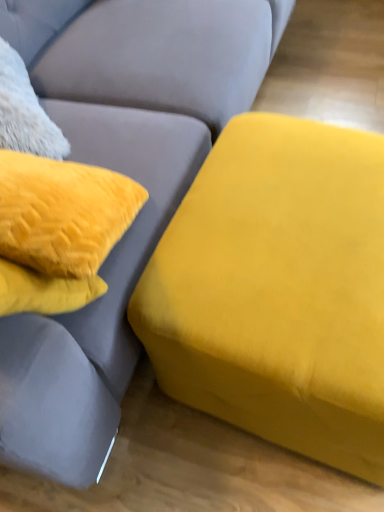
Question: Considering their positions, is velvet yellow ottoman at right, placed as the 1th studio couch when sorted from top to bottom, located in front of or behind velvet yellow ottoman at right, positioned as the 1th studio couch in bottom-to-top order?

Choices:
 (A) behind
 (B) front

Answer: (B)

Question: Is velvet yellow ottoman at right, placed as the 1th studio couch when sorted from top to bottom, wider or thinner than velvet yellow ottoman at right, which is the 2th studio couch in top-to-bottom order?

Choices:
 (A) wide
 (B) thin

Answer: (A)

Question: In the image, is velvet yellow ottoman at right, marked as the 2th studio couch in a bottom-to-top arrangement, on the left side or the right side of velvet yellow ottoman at right, positioned as the 1th studio couch in bottom-to-top order?

Choices:
 (A) left
 (B) right

Answer: (A)

Question: Considering the positions of point (276, 422) and point (82, 377), is point (276, 422) closer or farther from the camera than point (82, 377)?

Choices:
 (A) farther
 (B) closer

Answer: (A)

Question: Looking at their shapes, would you say velvet yellow ottoman at right, positioned as the 1th studio couch in bottom-to-top order, is wider or thinner than velvet yellow ottoman at right, marked as the 2th studio couch in a bottom-to-top arrangement?

Choices:
 (A) thin
 (B) wide

Answer: (A)

Question: Would you say velvet yellow ottoman at right, positioned as the 1th studio couch in bottom-to-top order, is inside or outside velvet yellow ottoman at right, placed as the 1th studio couch when sorted from top to bottom?

Choices:
 (A) outside
 (B) inside

Answer: (A)

Question: From a real-world perspective, relative to velvet yellow ottoman at right, marked as the 2th studio couch in a bottom-to-top arrangement, is velvet yellow ottoman at right, which is the 2th studio couch in top-to-bottom order, vertically above or below?

Choices:
 (A) below
 (B) above

Answer: (A)